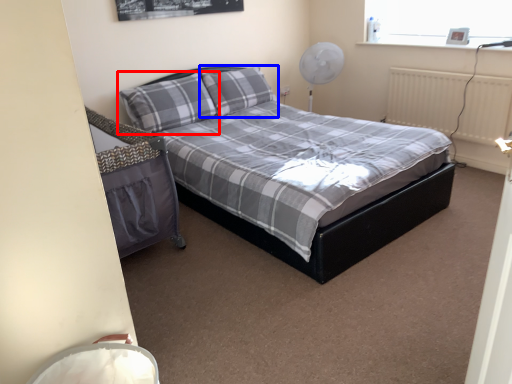
Question: Which of the following is the farthest to the observer, pillow (highlighted by a red box) or pillow (highlighted by a blue box)?

Choices:
 (A) pillow
 (B) pillow

Answer: (B)